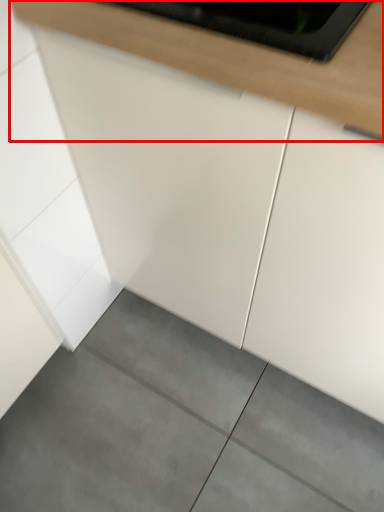
Question: From the image's perspective, considering the relative positions of countertop (annotated by the red box) and concrete in the image provided, where is countertop (annotated by the red box) located with respect to the staircase?

Choices:
 (A) below
 (B) above

Answer: (B)